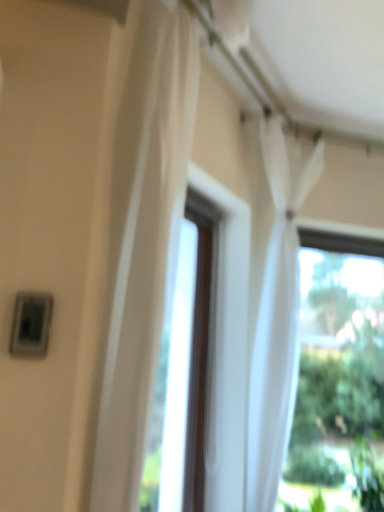
Question: Choose the correct answer: Is white sheer curtain at center, which is the second curtain in right-to-left order, inside white sheer curtain at upper center, which is the first curtain in right-to-left order, or outside it?

Choices:
 (A) inside
 (B) outside

Answer: (B)

Question: From a real-world perspective, is white sheer curtain at center, which is the second curtain in right-to-left order, positioned above or below white sheer curtain at upper center, the 2th curtain from the left?

Choices:
 (A) below
 (B) above

Answer: (B)

Question: From the image's perspective, is white sheer curtain at center, which is the second curtain in right-to-left order, located above or below white sheer curtain at upper center, which is the 1th curtain in back-to-front order?

Choices:
 (A) below
 (B) above

Answer: (B)

Question: In terms of height, does white sheer curtain at upper center, which is the first curtain in right-to-left order, look taller or shorter compared to white sheer curtain at center, the 1th curtain positioned from the front?

Choices:
 (A) tall
 (B) short

Answer: (A)

Question: In the image, is white sheer curtain at upper center, which is the first curtain in right-to-left order, on the left side or the right side of white sheer curtain at center, the 1th curtain positioned from the front?

Choices:
 (A) left
 (B) right

Answer: (B)

Question: In terms of width, does white sheer curtain at upper center, the 2th curtain from the left, look wider or thinner when compared to white sheer curtain at center, the 1th curtain positioned from the front?

Choices:
 (A) thin
 (B) wide

Answer: (A)

Question: Is point (307, 184) closer or farther from the camera than point (193, 109)?

Choices:
 (A) closer
 (B) farther

Answer: (B)